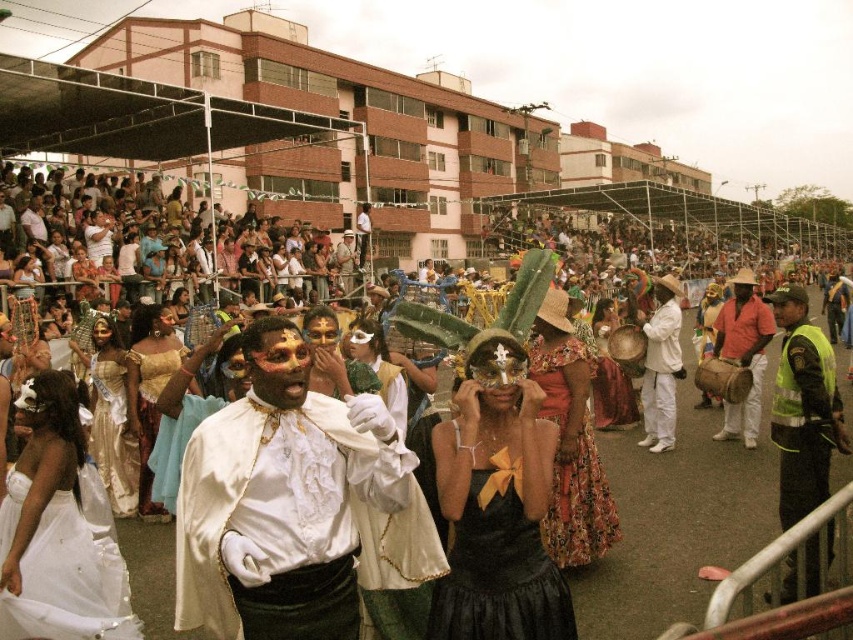
Question: Is white satin dress at lower left above orange cotton shirt at center?

Choices:
 (A) no
 (B) yes

Answer: (A)

Question: Where is white satin dress at lower left located in relation to gold satin dress at center in the image?

Choices:
 (A) left
 (B) right

Answer: (B)

Question: Which object is closer to the camera taking this photo?

Choices:
 (A) white satin cape at center
 (B) floral fabric dress at center
 (C) gold satin dress at center

Answer: (A)

Question: Which point is farther to the camera?

Choices:
 (A) pos(260,371)
 (B) pos(346,282)

Answer: (B)

Question: Is floral fabric dress at center positioned before gold satin dress at center?

Choices:
 (A) no
 (B) yes

Answer: (B)

Question: Which object is positioned farthest from the white satin dress at lower left?

Choices:
 (A) green reflective vest at right
 (B) white satin cape at center

Answer: (A)